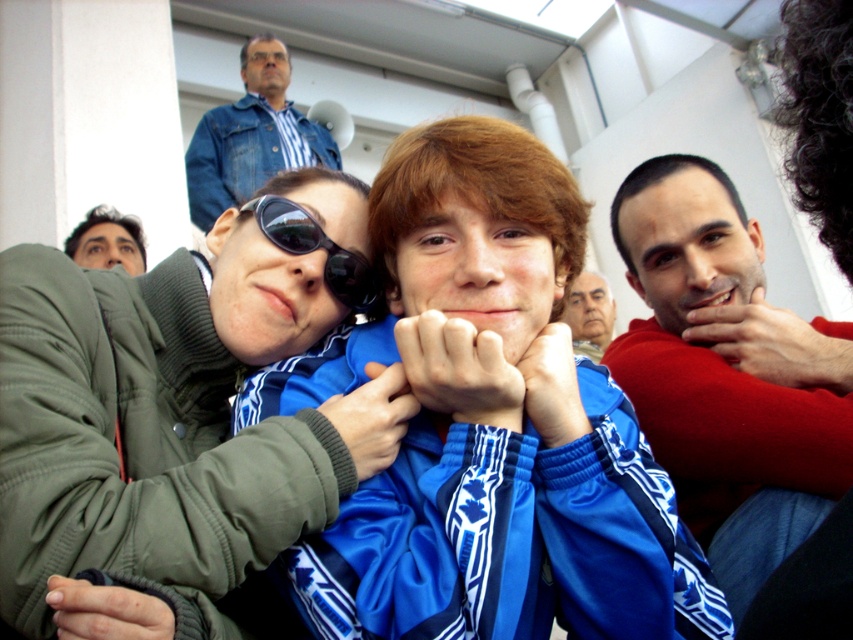
Between green matte jacket at center and denim jacket at upper center, which one has more height?

denim jacket at upper center

Does point (67, 416) lie in front of point (196, 198)?

Yes, point (67, 416) is closer to viewer.

Locate an element on the screen. Image resolution: width=853 pixels, height=640 pixels. green matte jacket at center is located at coordinates [x=175, y=408].

Find the location of `denim jacket at upper center`. denim jacket at upper center is located at coordinates (251, 136).

What do you see at coordinates (251, 136) in the screenshot?
I see `denim jacket at upper center` at bounding box center [251, 136].

Where is `denim jacket at upper center`? denim jacket at upper center is located at coordinates (251, 136).

Which is more to the right, blue satin jacket at center or black reflective sunglasses at center?

Positioned to the right is blue satin jacket at center.

This screenshot has height=640, width=853. I want to click on blue satin jacket at center, so click(x=488, y=426).